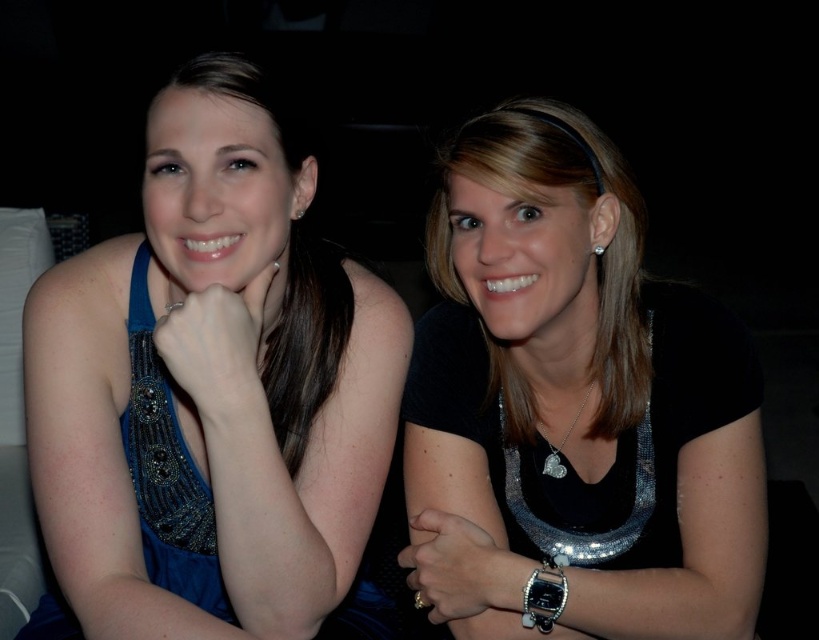
Question: Which object is closer to the camera taking this photo?

Choices:
 (A) blue beaded dress at left
 (B) black sequined dress at center
 (C) satin black blouse at center

Answer: (A)

Question: Is blue beaded dress at left to the left of black sequined dress at center from the viewer's perspective?

Choices:
 (A) no
 (B) yes

Answer: (B)

Question: Is the position of blue beaded dress at left less distant than that of black sequined dress at center?

Choices:
 (A) no
 (B) yes

Answer: (B)

Question: Is blue beaded dress at left to the left of black sequined dress at center from the viewer's perspective?

Choices:
 (A) yes
 (B) no

Answer: (A)

Question: Which object appears closest to the camera in this image?

Choices:
 (A) satin black blouse at center
 (B) blue beaded dress at left
 (C) black sequined dress at center

Answer: (B)

Question: Considering the real-world distances, which object is closest to the satin black blouse at center?

Choices:
 (A) black sequined dress at center
 (B) blue beaded dress at left

Answer: (A)